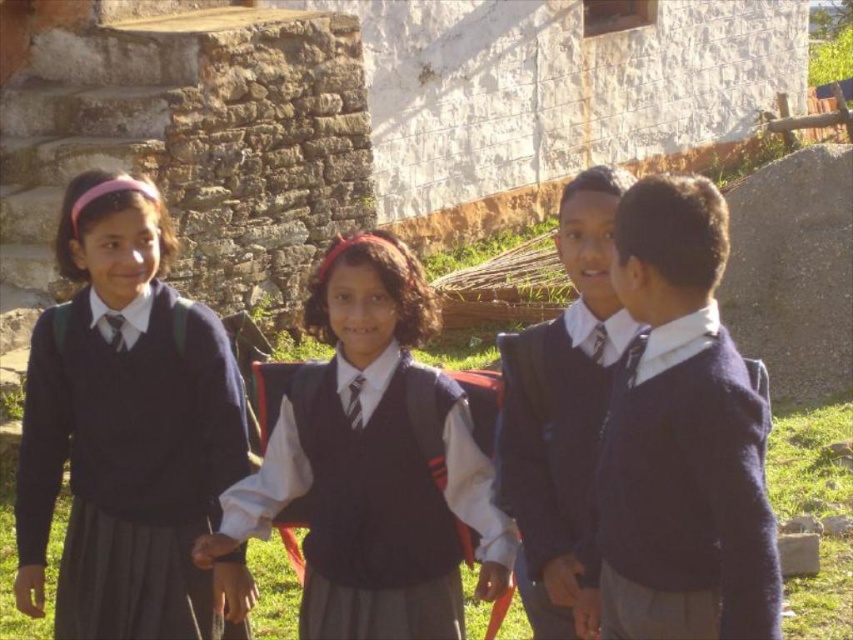
From the picture: Does matte black sweater at left have a greater height compared to matte blue sweater at right?

No, matte black sweater at left is not taller than matte blue sweater at right.

Between matte black sweater at left and matte blue sweater at right, which one is positioned higher?

matte black sweater at left is higher up.

Locate an element on the screen. matte black sweater at left is located at coordinates (128, 432).

In the scene shown: Who is more distant from viewer, (701, 202) or (589, 241)?

Positioned behind is point (589, 241).

Can you confirm if matte blue sweater at right is smaller than matte black sweater at center?

Correct, matte blue sweater at right occupies less space than matte black sweater at center.

Is point (645, 589) more distant than point (578, 269)?

That is False.

Image resolution: width=853 pixels, height=640 pixels. Find the location of `matte blue sweater at right`. matte blue sweater at right is located at coordinates (682, 438).

At what (x,y) coordinates should I click in order to perform the action: click on matte black sweater at left. Please return your answer as a coordinate pair (x, y). The height and width of the screenshot is (640, 853). Looking at the image, I should click on (128, 432).

Is point (33, 412) farther from viewer compared to point (244, 499)?

Yes, it is behind point (244, 499).

Find the location of a particular element. Image resolution: width=853 pixels, height=640 pixels. matte black sweater at left is located at coordinates (128, 432).